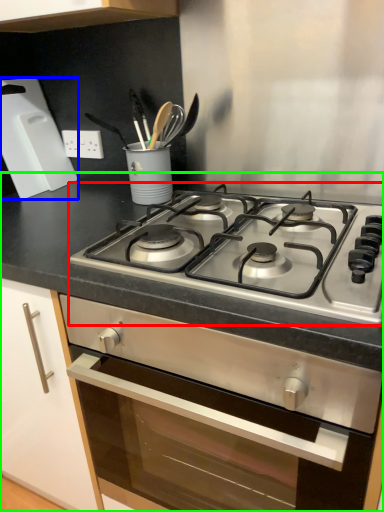
Question: Considering the real-world distances, which object is closest to gas stove (highlighted by a red box)? kitchen appliance (highlighted by a blue box) or countertop (highlighted by a green box).

Choices:
 (A) kitchen appliance
 (B) countertop

Answer: (B)